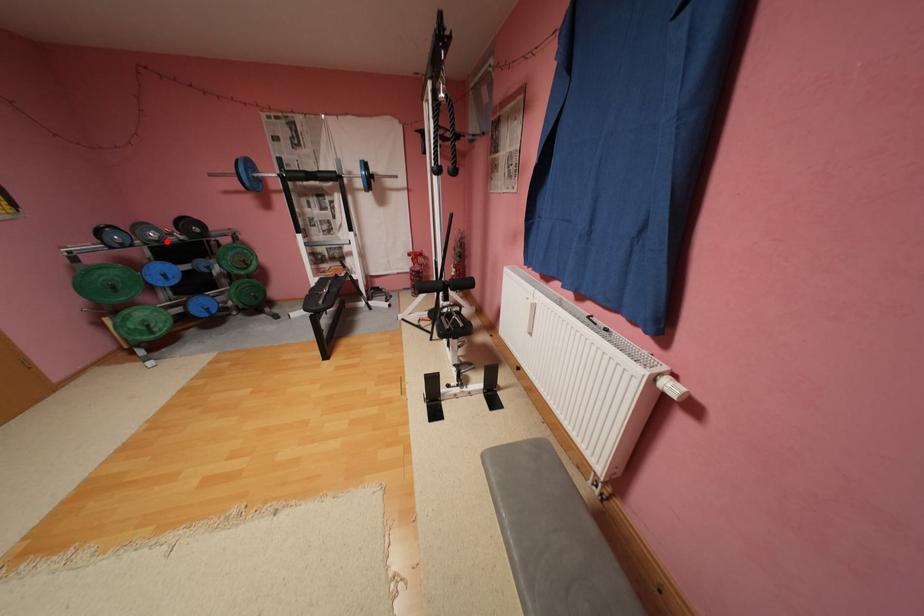
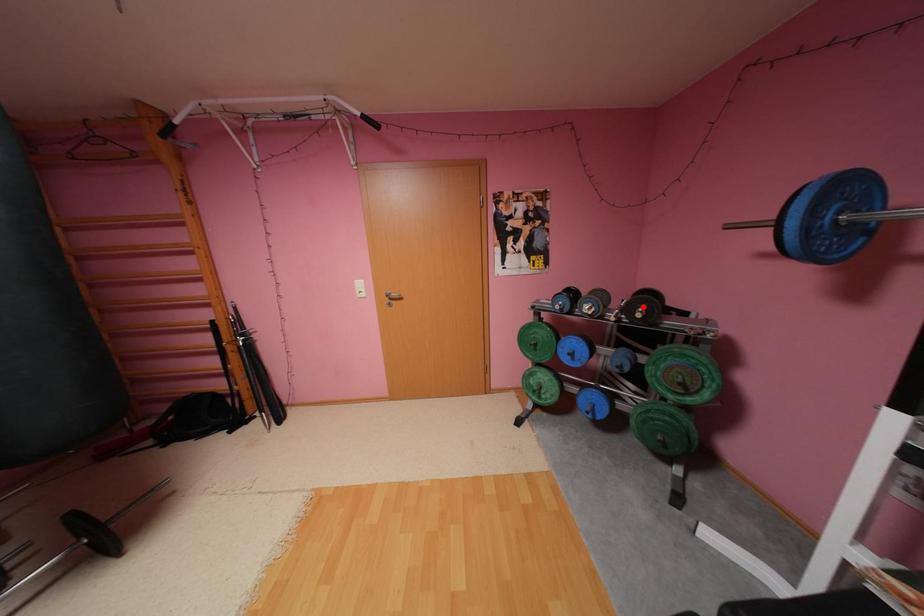
I am providing you with two images of the same scene from different viewpoints. A red point is marked on the first image and another point is marked on the second image. Does the point marked in image1 correspond to the same location as the one in image2?

No